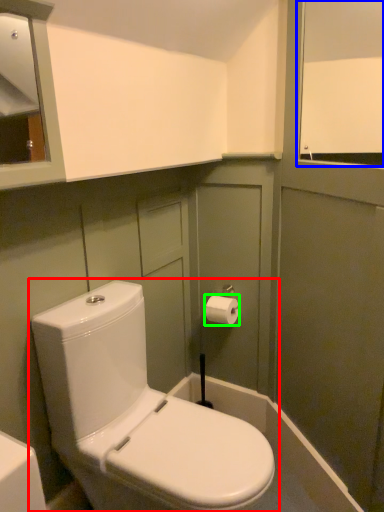
Question: Based on their relative distances, which object is nearer to toilet (highlighted by a red box)? Choose from window screen (highlighted by a blue box) and toiletry (highlighted by a green box).

Choices:
 (A) window screen
 (B) toiletry

Answer: (B)